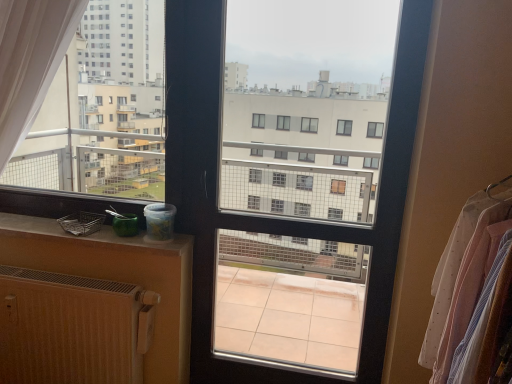
You are a GUI agent. You are given a task and a screenshot of the screen. Output one action in this format:
    pyautogui.click(x=<x>, y=<y>)
    Task: Click on the free spot above matte plastic container at lower left (from a real-world perspective)
    The image size is (512, 384).
    Given the screenshot: What is the action you would take?
    pyautogui.click(x=73, y=223)